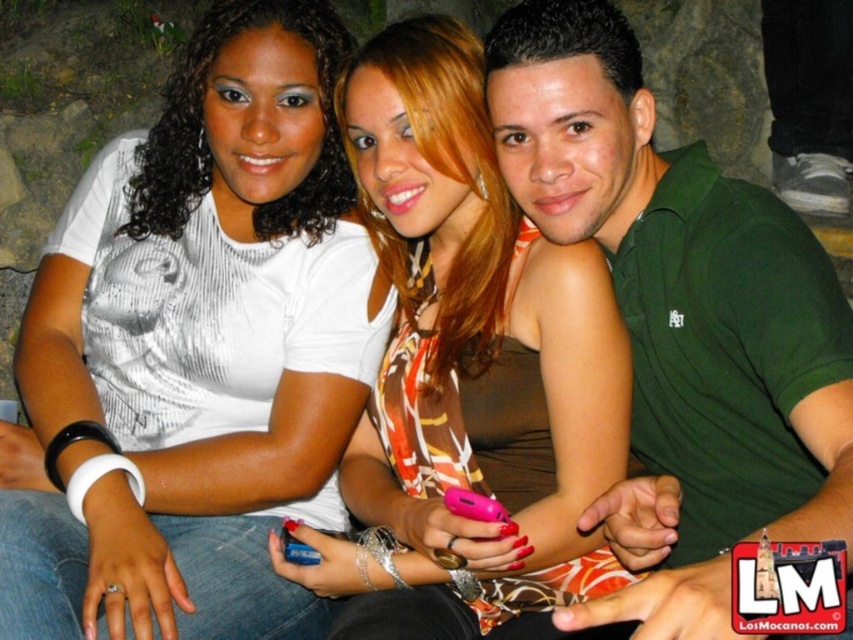
Question: Considering the real-world distances, which object is closest to the white matte shirt at upper left?

Choices:
 (A) printed fabric dress at center
 (B) green matte shirt at center

Answer: (A)

Question: Does white matte shirt at upper left appear under green matte shirt at center?

Choices:
 (A) yes
 (B) no

Answer: (A)

Question: Which point is farther to the camera?

Choices:
 (A) (442, 154)
 (B) (175, 429)

Answer: (B)

Question: Which of the following is the closest to the observer?

Choices:
 (A) (558, 168)
 (B) (158, 522)
 (C) (581, 369)

Answer: (A)

Question: Is printed fabric dress at center wider than green matte shirt at center?

Choices:
 (A) yes
 (B) no

Answer: (A)

Question: Can you confirm if white matte shirt at upper left is wider than green matte shirt at center?

Choices:
 (A) no
 (B) yes

Answer: (B)